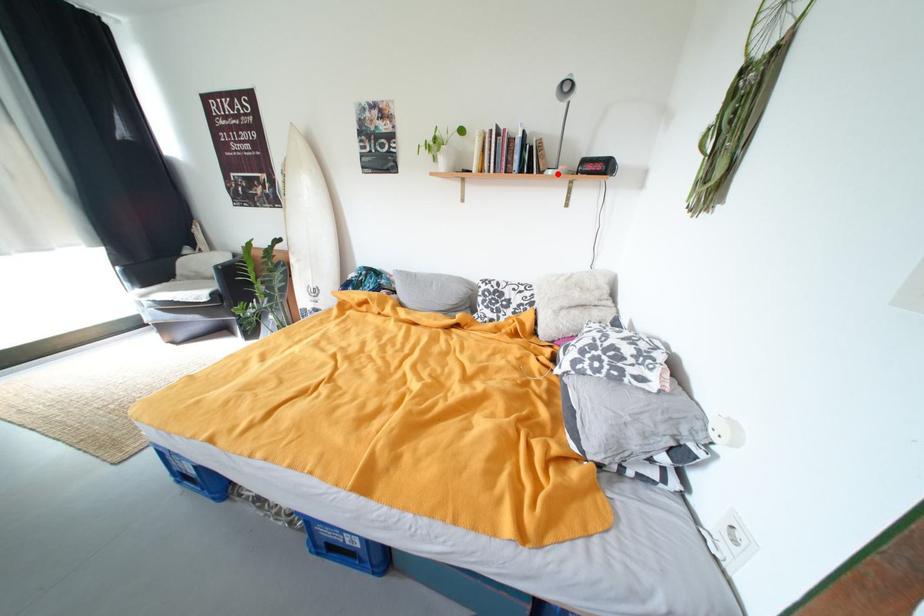
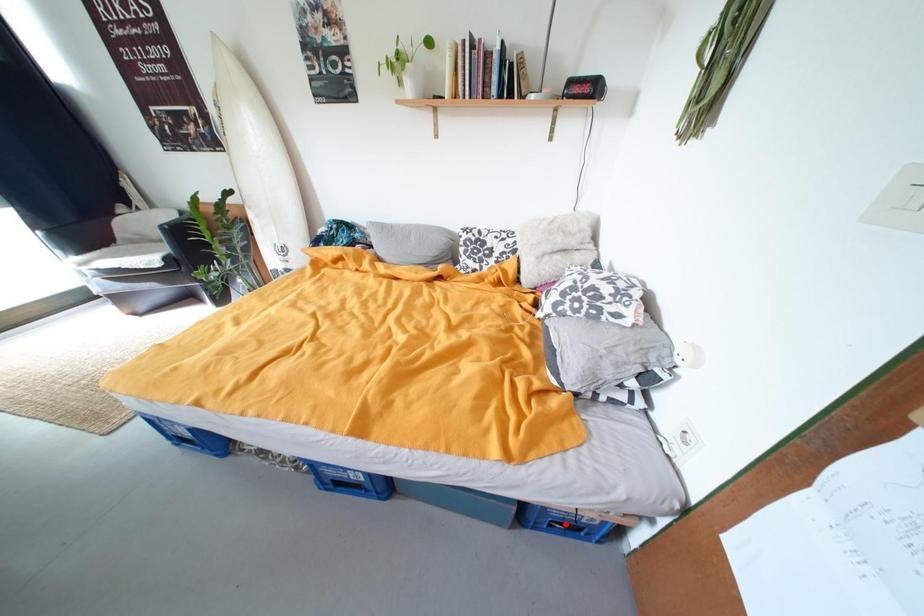
I am providing you with two images of the same scene from different viewpoints. A red point is marked on the first image and another point is marked on the second image. Is the marked point in image1 the same physical position as the marked point in image2?

No